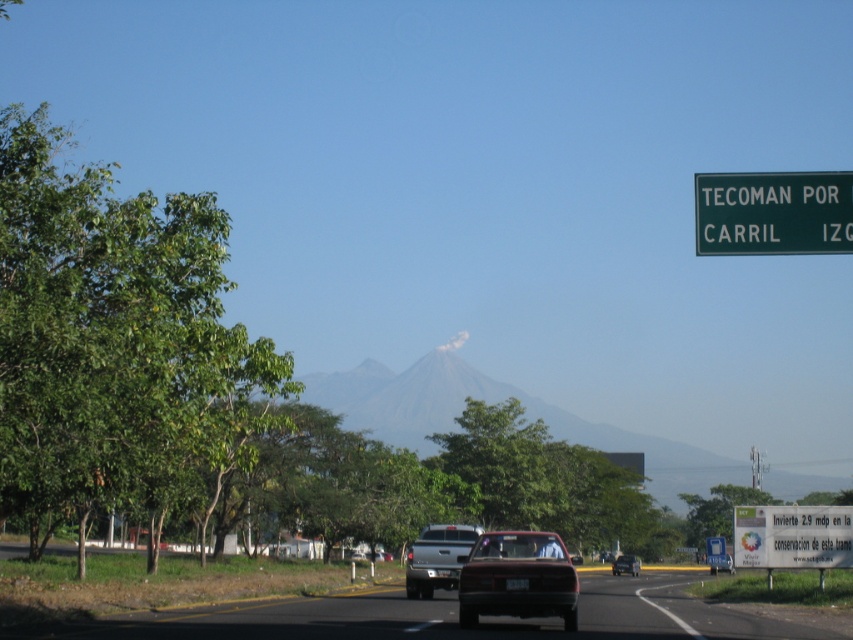
You are a GUI agent. You are given a task and a screenshot of the screen. Output one action in this format:
    pyautogui.click(x=<x>, y=<y>)
    Task: Click on the greenmaterial/texturesign at upper right
    
    Given the screenshot: What is the action you would take?
    pyautogui.click(x=773, y=212)

Which of these two, greenmaterial/texturesign at upper right or metallic silver sedan at center, stands taller?

Standing taller between the two is greenmaterial/texturesign at upper right.

Which is behind, point (759, 182) or point (367, 552)?

The point (367, 552) is behind.

Image resolution: width=853 pixels, height=640 pixels. In order to click on greenmaterial/texturesign at upper right in this screenshot , I will do `click(773, 212)`.

Between black asphalt road at center and metallic silver sedan at center, which one appears on the left side from the viewer's perspective?

metallic silver sedan at center is more to the left.

The height and width of the screenshot is (640, 853). In order to click on black asphalt road at center in this screenshot , I will do [448, 618].

Who is more distant from viewer, (634, 620) or (364, 557)?

Positioned behind is point (364, 557).

This screenshot has width=853, height=640. Identify the location of black asphalt road at center. (448, 618).

Is green leafy tree at center shorter than matte red car at center?

In fact, green leafy tree at center may be taller than matte red car at center.

Is point (700, 500) positioned after point (619, 556)?

Yes, point (700, 500) is behind point (619, 556).

Locate an element on the screen. green leafy tree at center is located at coordinates (718, 509).